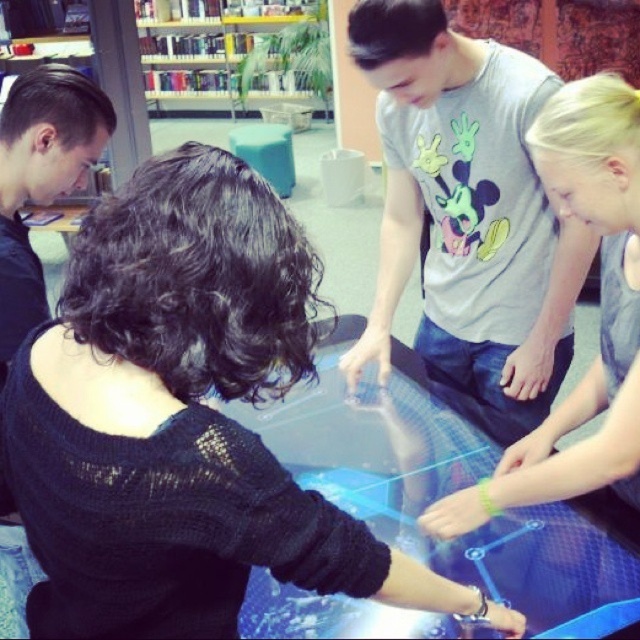
You are a visitor at the science center and want to place your black knitted sweater at center on top of the wooden bookshelf at upper center. Based on their sizes, do you think the sweater will fit without hanging over the edges?

The black knitted sweater at center is smaller in size compared to the wooden bookshelf at upper center, so it should fit without hanging over the edges.

You are a visitor at the science center and want to place a rectangular box that is 1 meter wide onto the surface next to the black knitted sweater at center. Can the surface accommodate the box without overlapping the wooden bookshelf at upper center?

The black knitted sweater at center is narrower than the wooden bookshelf at upper center. Since the box is 1 meter wide, and the sweater is narrower, the surface might have enough space. However, the exact distance between the sweater and the bookshelf isn

You are a visitor at the science center and want to observe the transparent plastic table at center and the wooden bookshelf at upper center. Which object is located higher up in the image?

The wooden bookshelf at upper center is located higher up in the image than the transparent plastic table at center.